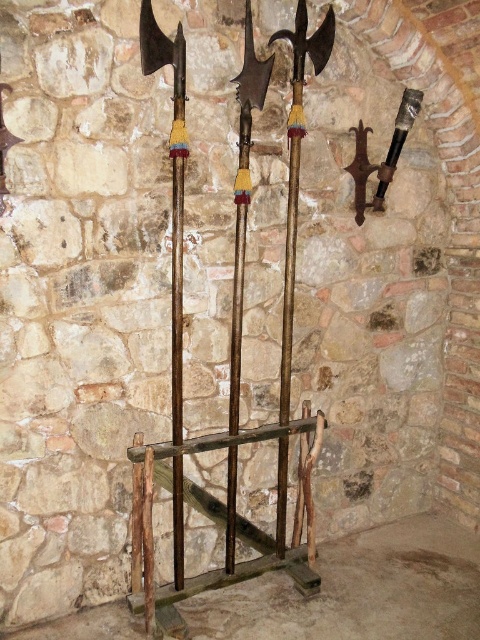
Question: Estimate the real-world distances between objects in this image. Which object is farther from the brown leather belt at upper right?

Choices:
 (A) rusty metal axe at center
 (B) polished silver sword at upper right
 (C) rusty wood ladder at center

Answer: (C)

Question: Estimate the real-world distances between objects in this image. Which object is farther from the rusty metal axe at center?

Choices:
 (A) wooden polished axe at center
 (B) polished silver sword at upper right
 (C) smooth stone floor at lower center

Answer: (B)

Question: Which of the following is the farthest from the observer?

Choices:
 (A) polished silver sword at upper right
 (B) wooden polished axe at center
 (C) rusty metal axe at center

Answer: (A)

Question: Does rusty metal axe at center appear under polished silver sword at upper right?

Choices:
 (A) no
 (B) yes

Answer: (B)

Question: Is wooden polished axe at center in front of polished bronze axe at center?

Choices:
 (A) no
 (B) yes

Answer: (A)

Question: Is the position of wooden polished axe at center more distant than that of brown leather belt at upper right?

Choices:
 (A) yes
 (B) no

Answer: (B)